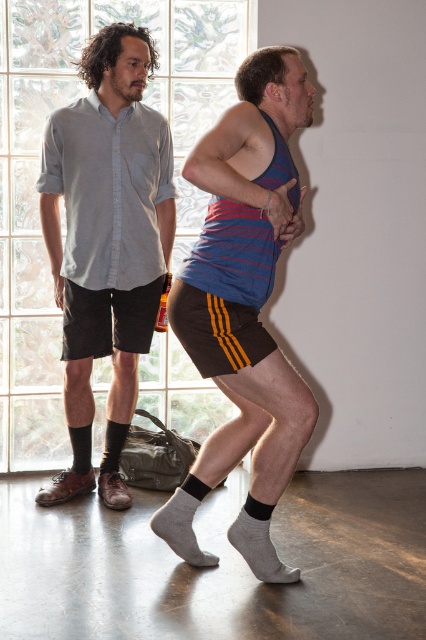
Between gray wool sock at lower center and black cotton sock at lower left, which one appears on the right side from the viewer's perspective?

Positioned to the right is gray wool sock at lower center.

The height and width of the screenshot is (640, 426). Identify the location of gray wool sock at lower center. [x=183, y=524].

You are a GUI agent. You are given a task and a screenshot of the screen. Output one action in this format:
    pyautogui.click(x=<x>, y=<y>)
    Task: Click on the gray wool sock at lower center
    The image size is (426, 640).
    Given the screenshot: What is the action you would take?
    pyautogui.click(x=183, y=524)

Is striped cotton tank top at center in front of black cotton sock at lower left?

Yes, striped cotton tank top at center is in front of black cotton sock at lower left.

At what (x,y) coordinates should I click in order to perform the action: click on striped cotton tank top at center. Please return your answer as a coordinate pair (x, y). Looking at the image, I should click on (244, 307).

Locate an element on the screen. This screenshot has height=640, width=426. striped cotton tank top at center is located at coordinates (244, 307).

Who is positioned more to the right, striped cotton tank top at center or gray cotton sock at lower center?

From the viewer's perspective, gray cotton sock at lower center appears more on the right side.

At what (x,y) coordinates should I click in order to perform the action: click on striped cotton tank top at center. Please return your answer as a coordinate pair (x, y). Image resolution: width=426 pixels, height=640 pixels. Looking at the image, I should click on (244, 307).

Describe the element at coordinates (244, 307) in the screenshot. I see `striped cotton tank top at center` at that location.

I want to click on striped cotton tank top at center, so click(x=244, y=307).